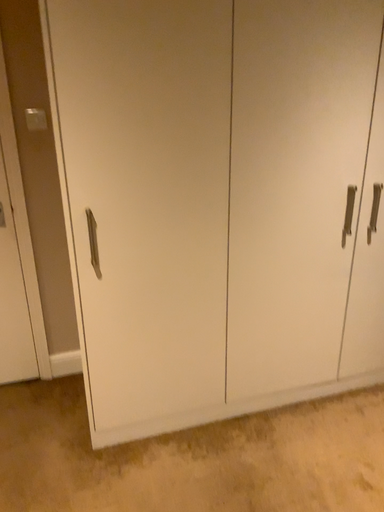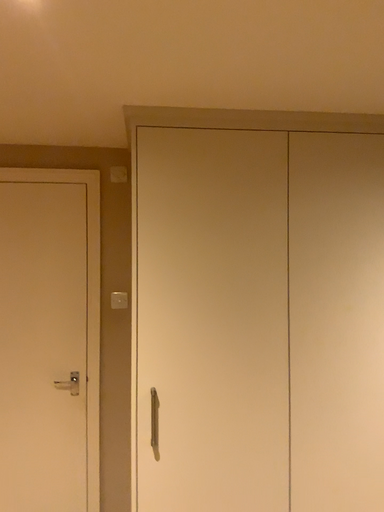
Question: How did the camera likely rotate when shooting the video?

Choices:
 (A) rotated left
 (B) rotated right

Answer: (A)